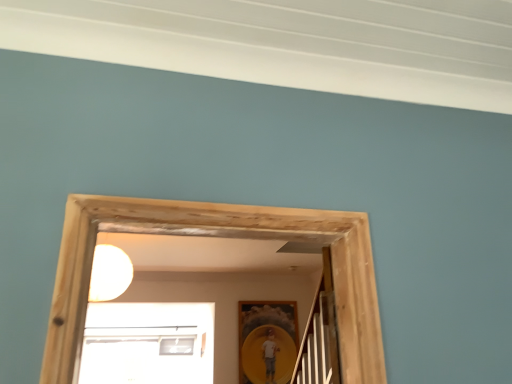
Question: Considering the relative sizes of white matte light bulb at upper center and matte yellow picture frame at center in the image provided, is white matte light bulb at upper center taller than matte yellow picture frame at center?

Choices:
 (A) yes
 (B) no

Answer: (B)

Question: Is white matte light bulb at upper center directly adjacent to matte yellow picture frame at center?

Choices:
 (A) no
 (B) yes

Answer: (A)

Question: Is white matte light bulb at upper center wider than matte yellow picture frame at center?

Choices:
 (A) no
 (B) yes

Answer: (B)

Question: Is white matte light bulb at upper center surrounding matte yellow picture frame at center?

Choices:
 (A) no
 (B) yes

Answer: (A)

Question: Is white matte light bulb at upper center to the left of matte yellow picture frame at center from the viewer's perspective?

Choices:
 (A) no
 (B) yes

Answer: (B)

Question: From a real-world perspective, is white matte light bulb at upper center located beneath matte yellow picture frame at center?

Choices:
 (A) no
 (B) yes

Answer: (A)

Question: Is matte yellow picture frame at center at the left side of white matte light bulb at upper center?

Choices:
 (A) no
 (B) yes

Answer: (A)

Question: From the image's perspective, is matte yellow picture frame at center over white matte light bulb at upper center?

Choices:
 (A) no
 (B) yes

Answer: (A)

Question: Considering the relative sizes of matte yellow picture frame at center and white matte light bulb at upper center in the image provided, is matte yellow picture frame at center smaller than white matte light bulb at upper center?

Choices:
 (A) yes
 (B) no

Answer: (A)

Question: Is matte yellow picture frame at center at the right side of white matte light bulb at upper center?

Choices:
 (A) no
 (B) yes

Answer: (B)

Question: Is white matte light bulb at upper center surrounded by matte yellow picture frame at center?

Choices:
 (A) no
 (B) yes

Answer: (A)

Question: Is matte yellow picture frame at center oriented away from white matte light bulb at upper center?

Choices:
 (A) no
 (B) yes

Answer: (A)

Question: Choose the correct answer: Is matte yellow picture frame at center inside white matte light bulb at upper center or outside it?

Choices:
 (A) inside
 (B) outside

Answer: (B)